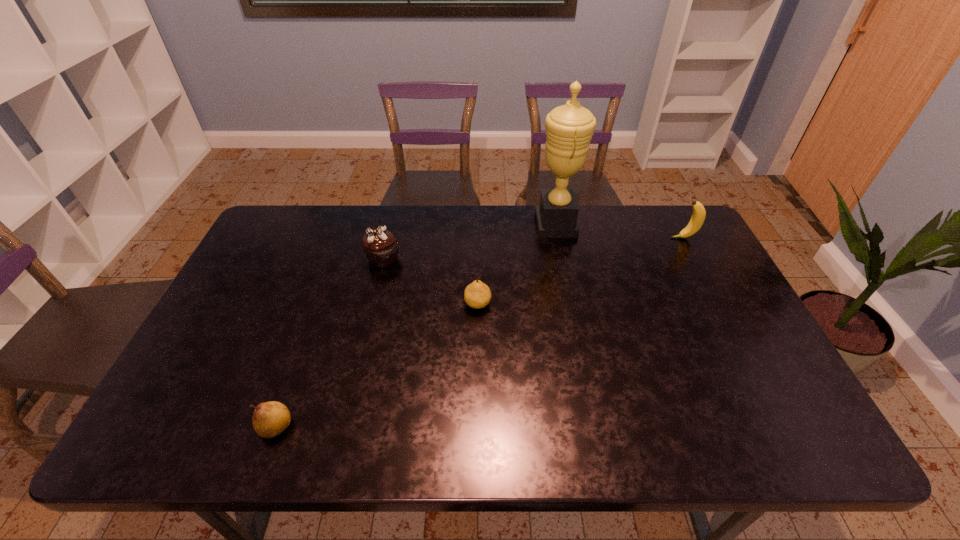
Find the location of a particular element. The image size is (960, 540). free space between the second object from left to right and the fourth shortest object is located at coordinates (533, 248).

The width and height of the screenshot is (960, 540). Identify the location of vacant area that lies between the third farthest object and the second object from right to left. (469, 241).

The width and height of the screenshot is (960, 540). In order to click on empty space between the tallest object and the banana in this screenshot , I will do `click(619, 231)`.

Where is `object that is the third closest to the fourth farthest object`? object that is the third closest to the fourth farthest object is located at coordinates pyautogui.click(x=270, y=419).

Where is `object that stands as the third closest to the second object from left to right`? Image resolution: width=960 pixels, height=540 pixels. object that stands as the third closest to the second object from left to right is located at coordinates (270, 419).

Where is `vacant space that satisfies the following two spatial constraints: 1. from the stem of the fourth shortest object; 2. on the front side of the cupcake`? This screenshot has width=960, height=540. vacant space that satisfies the following two spatial constraints: 1. from the stem of the fourth shortest object; 2. on the front side of the cupcake is located at coordinates (694, 259).

Identify the location of vacant point that satisfies the following two spatial constraints: 1. at the front of the trophy cup with handles; 2. on the front side of the nearer pear. This screenshot has width=960, height=540. (597, 427).